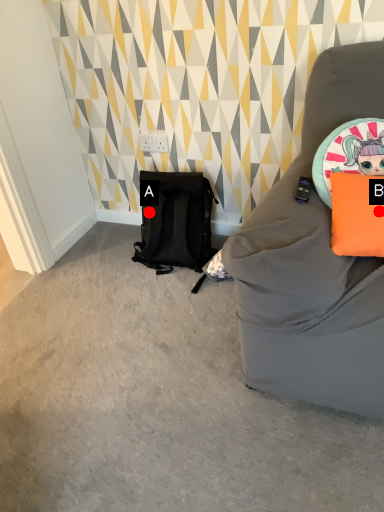
Question: Two points are circled on the image, labeled by A and B beside each circle. Among these points, which one is farthest from the camera?

Choices:
 (A) A is further
 (B) B is further

Answer: (A)